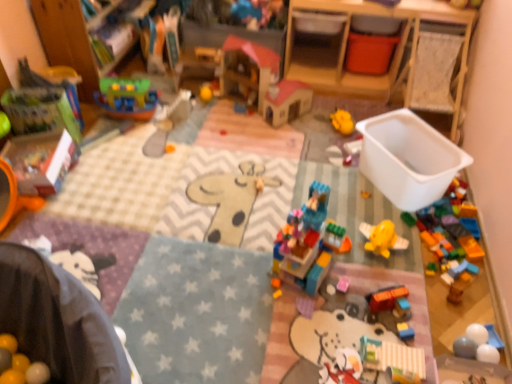
Identify the location of empty space that is to the right of translucent plastic castle at center, marked as the third toy in a bottom-to-top arrangement. The image size is (512, 384). (356, 281).